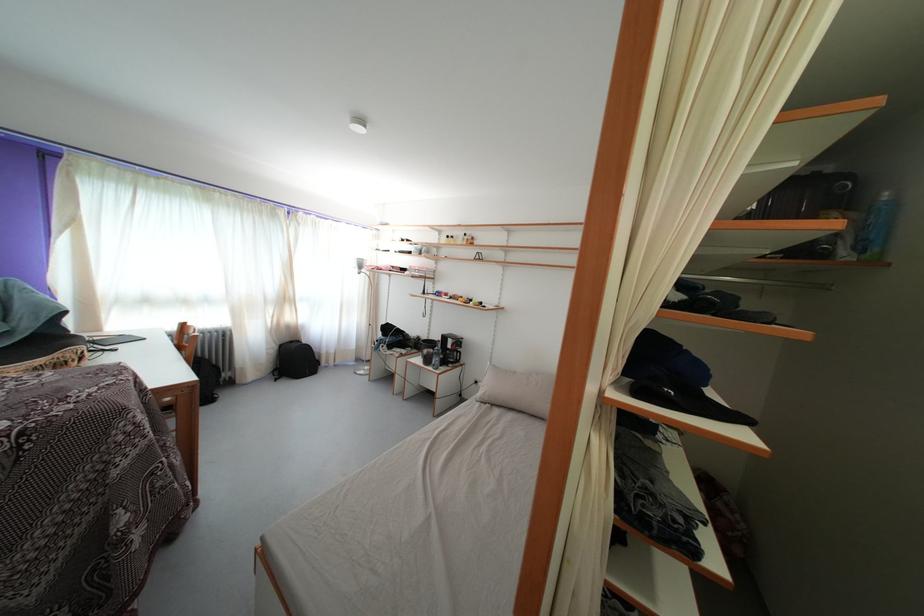
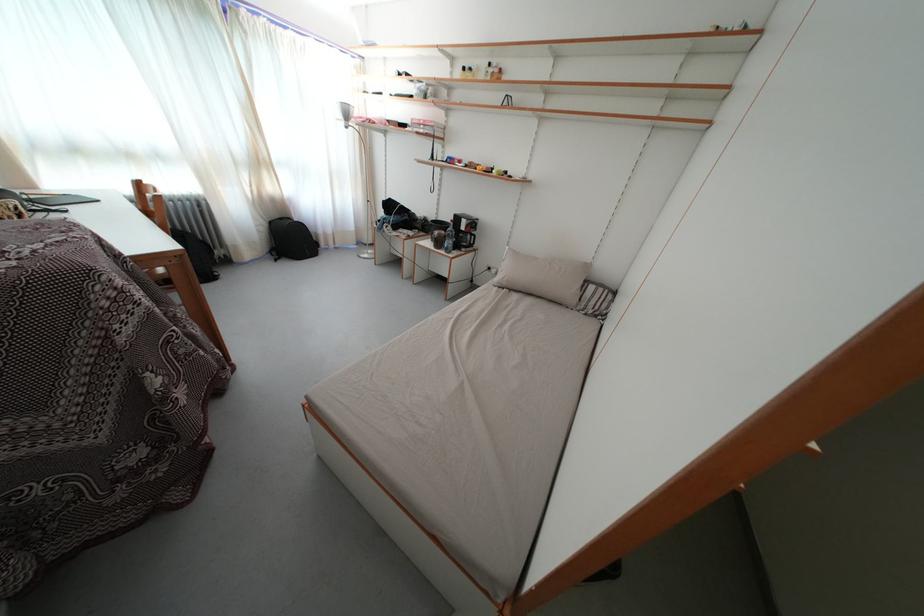
In the second image, find the point that corresponds to pixel 454 358 in the first image.

(467, 240)